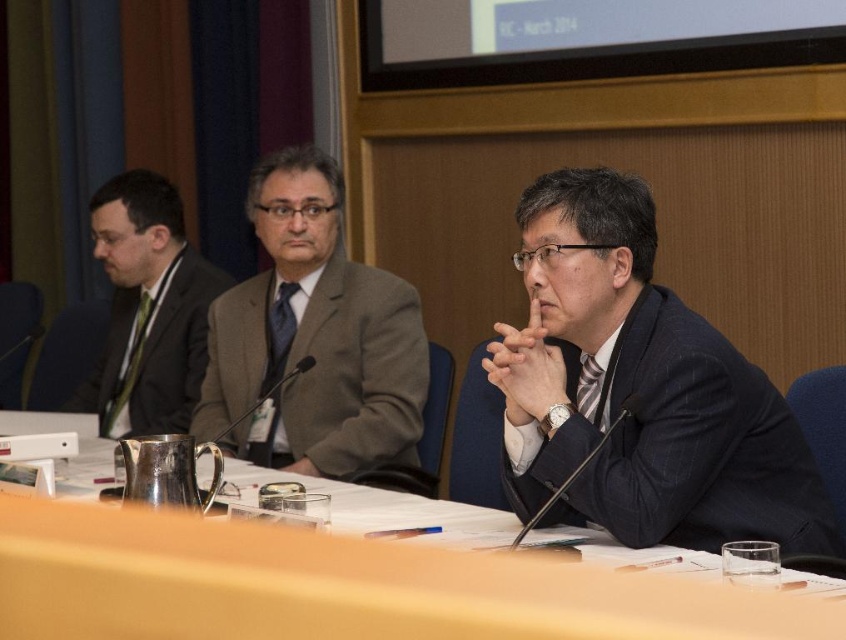
Can you confirm if smooth wooden table at center is shorter than green silk business suit at left?

Indeed, smooth wooden table at center has a lesser height compared to green silk business suit at left.

Is smooth wooden table at center smaller than green silk business suit at left?

Yes.

Is point (1, 513) less distant than point (185, 412)?

Yes, point (1, 513) is in front of point (185, 412).

Locate an element on the screen. This screenshot has height=640, width=846. smooth wooden table at center is located at coordinates (x=352, y=576).

Describe the element at coordinates (678, 445) in the screenshot. I see `dark blue textured suit at center` at that location.

Does dark blue textured suit at center have a lesser height compared to green silk business suit at left?

Yes, dark blue textured suit at center is shorter than green silk business suit at left.

Does point (624, 497) come farther from viewer compared to point (158, 317)?

No, it is in front of (158, 317).

At what (x,y) coordinates should I click in order to perform the action: click on dark blue textured suit at center. Please return your answer as a coordinate pair (x, y). This screenshot has width=846, height=640. Looking at the image, I should click on (678, 445).

Is point (526, 573) farther from viewer compared to point (656, 422)?

No, (526, 573) is in front of (656, 422).

Who is shorter, smooth wooden table at center or dark blue textured suit at center?

smooth wooden table at center is shorter.

The height and width of the screenshot is (640, 846). Find the location of `smooth wooden table at center`. smooth wooden table at center is located at coordinates pyautogui.click(x=352, y=576).